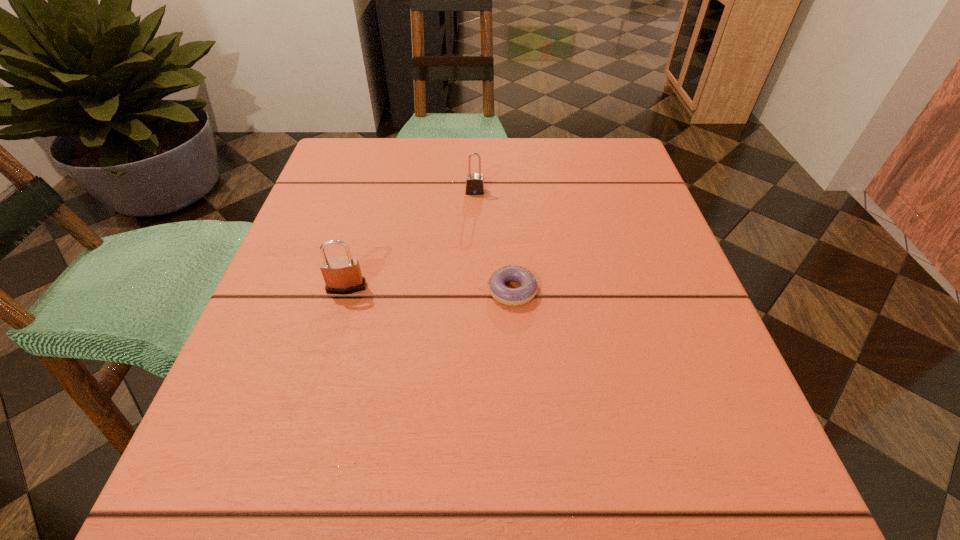
Where is `object located in the left edge section of the desktop`? object located in the left edge section of the desktop is located at coordinates (342, 275).

Where is `vacant position at the far edge of the desktop`? vacant position at the far edge of the desktop is located at coordinates (506, 190).

In the image, there is a desktop. At what (x,y) coordinates should I click in order to perform the action: click on blank space at the left edge. Please return your answer as a coordinate pair (x, y). Looking at the image, I should click on (304, 204).

Find the location of `vacant space at the right edge of the desktop`. vacant space at the right edge of the desktop is located at coordinates (588, 217).

Find the location of a particular element. The image size is (960, 540). vacant space at the far left corner of the desktop is located at coordinates (370, 193).

In the image, there is a desktop. Where is `vacant space at the near left corner`? This screenshot has width=960, height=540. vacant space at the near left corner is located at coordinates pyautogui.click(x=193, y=510).

At what (x,y) coordinates should I click in order to perform the action: click on vacant space at the far right corner of the desktop. Please return your answer as a coordinate pair (x, y). This screenshot has height=540, width=960. Looking at the image, I should click on (618, 143).

Where is `vacant space that is in between the doughnut and the leftmost object`? vacant space that is in between the doughnut and the leftmost object is located at coordinates (429, 289).

Identify the location of empty space between the left padlock and the shortest object. (429, 289).

Where is `empty location between the shortest object and the leftmost object`? The height and width of the screenshot is (540, 960). empty location between the shortest object and the leftmost object is located at coordinates (429, 289).